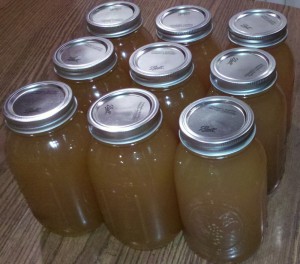
Where is `table`? table is located at coordinates (20, 48).